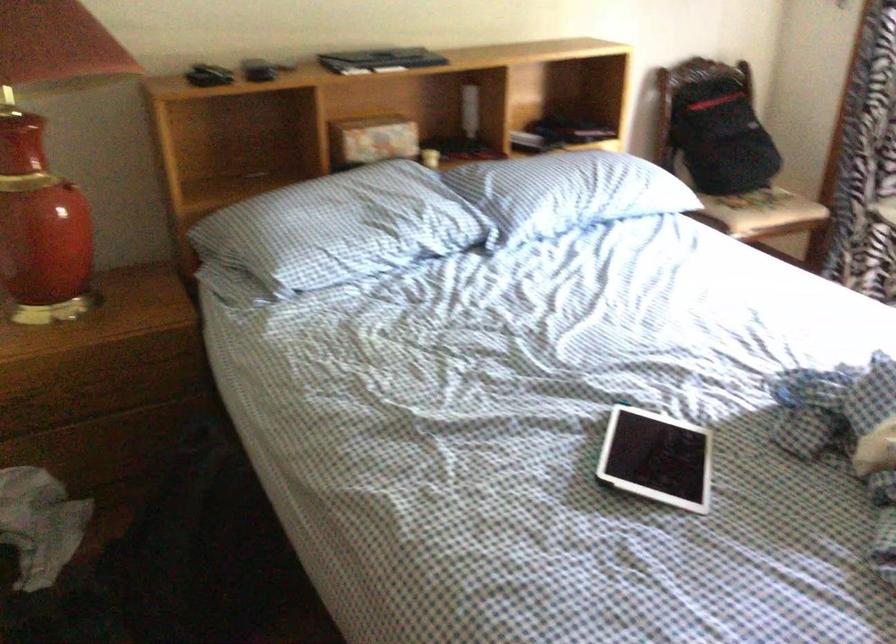
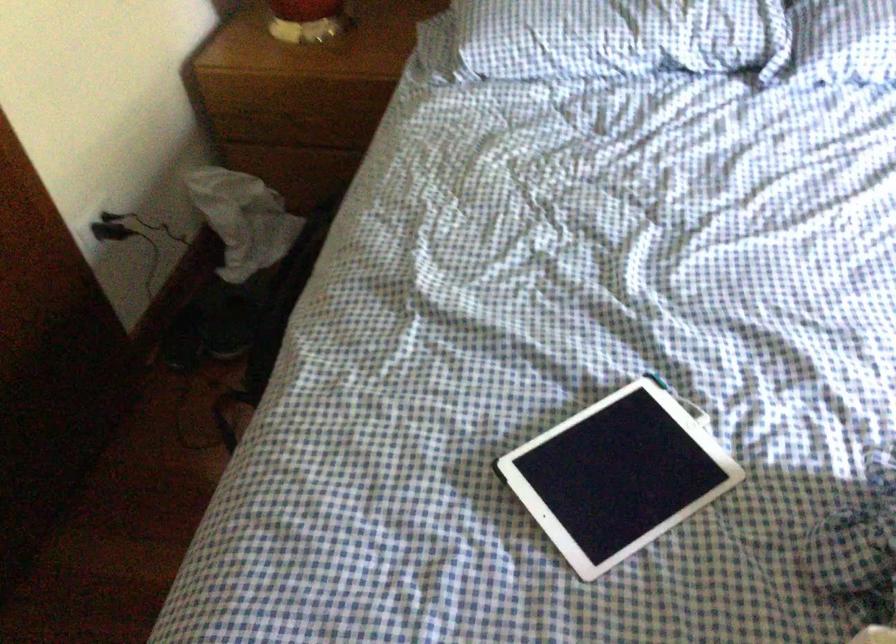
How did the camera likely rotate?

The camera rotated toward left-down.